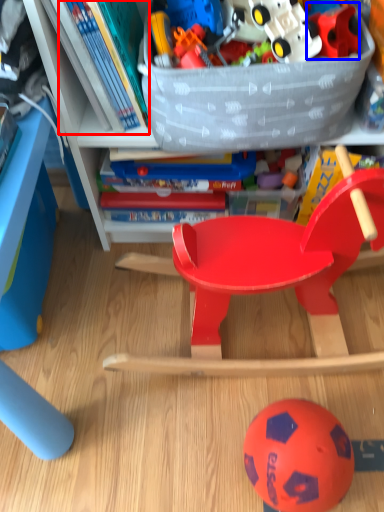
Question: Which object appears closest to the camera in this image, book (highlighted by a red box) or toy (highlighted by a blue box)?

Choices:
 (A) book
 (B) toy

Answer: (A)